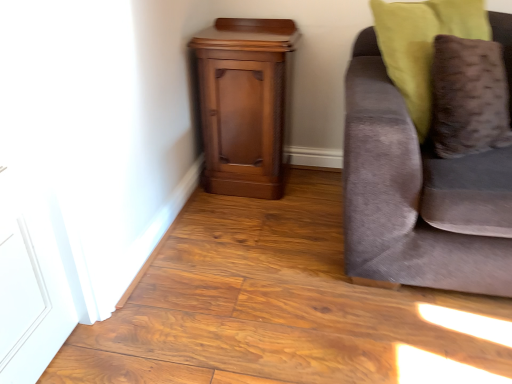
Question: Considering the relative sizes of polished wood nightstand at lower left and velvet brown pillow at right in the image provided, is polished wood nightstand at lower left wider than velvet brown pillow at right?

Choices:
 (A) yes
 (B) no

Answer: (A)

Question: Can you confirm if polished wood nightstand at lower left is positioned to the left of velvet brown pillow at right?

Choices:
 (A) yes
 (B) no

Answer: (A)

Question: From the image's perspective, is polished wood nightstand at lower left beneath velvet brown pillow at right?

Choices:
 (A) yes
 (B) no

Answer: (B)

Question: Considering the relative sizes of polished wood nightstand at lower left and velvet brown pillow at right in the image provided, is polished wood nightstand at lower left thinner than velvet brown pillow at right?

Choices:
 (A) yes
 (B) no

Answer: (B)

Question: From a real-world perspective, is polished wood nightstand at lower left positioned under velvet brown pillow at right based on gravity?

Choices:
 (A) yes
 (B) no

Answer: (A)

Question: From a real-world perspective, is velvet gray couch at right physically located above or below velvet brown pillow at right?

Choices:
 (A) above
 (B) below

Answer: (B)

Question: Is velvet gray couch at right taller or shorter than velvet brown pillow at right?

Choices:
 (A) short
 (B) tall

Answer: (B)

Question: In terms of size, does velvet gray couch at right appear bigger or smaller than velvet brown pillow at right?

Choices:
 (A) small
 (B) big

Answer: (B)

Question: Looking at their shapes, would you say velvet gray couch at right is wider or thinner than velvet brown pillow at right?

Choices:
 (A) wide
 (B) thin

Answer: (A)

Question: In terms of size, does velvet gray couch at right appear bigger or smaller than polished wood nightstand at lower left?

Choices:
 (A) small
 (B) big

Answer: (B)

Question: In the image, is velvet gray couch at right positioned in front of or behind polished wood nightstand at lower left?

Choices:
 (A) behind
 (B) front

Answer: (B)

Question: From the image's perspective, relative to polished wood nightstand at lower left, is velvet gray couch at right above or below?

Choices:
 (A) below
 (B) above

Answer: (A)

Question: In terms of height, does velvet gray couch at right look taller or shorter compared to polished wood nightstand at lower left?

Choices:
 (A) short
 (B) tall

Answer: (B)

Question: Considering the positions of polished wood nightstand at lower left and velvet brown pillow at right in the image, is polished wood nightstand at lower left bigger or smaller than velvet brown pillow at right?

Choices:
 (A) big
 (B) small

Answer: (A)

Question: In terms of height, does polished wood nightstand at lower left look taller or shorter compared to velvet brown pillow at right?

Choices:
 (A) short
 (B) tall

Answer: (B)